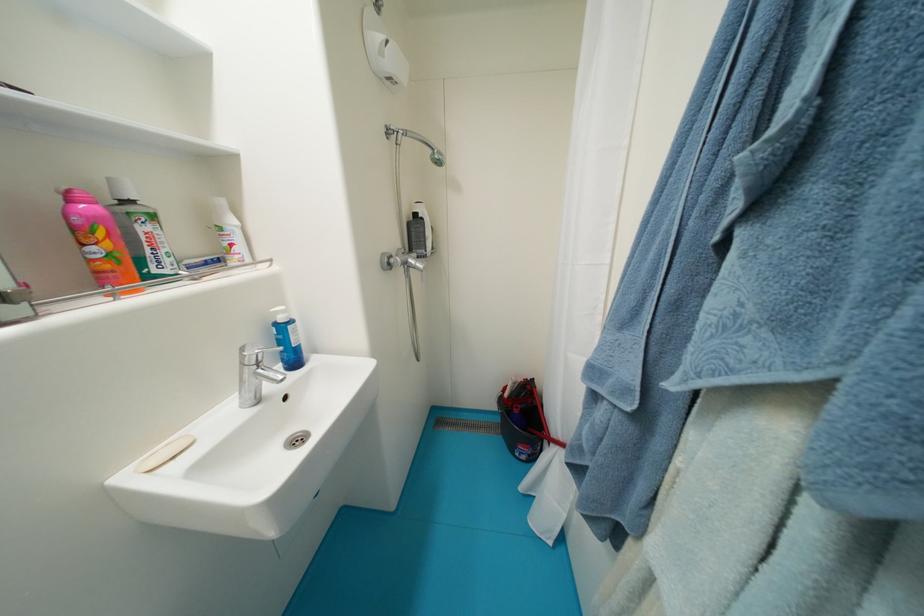
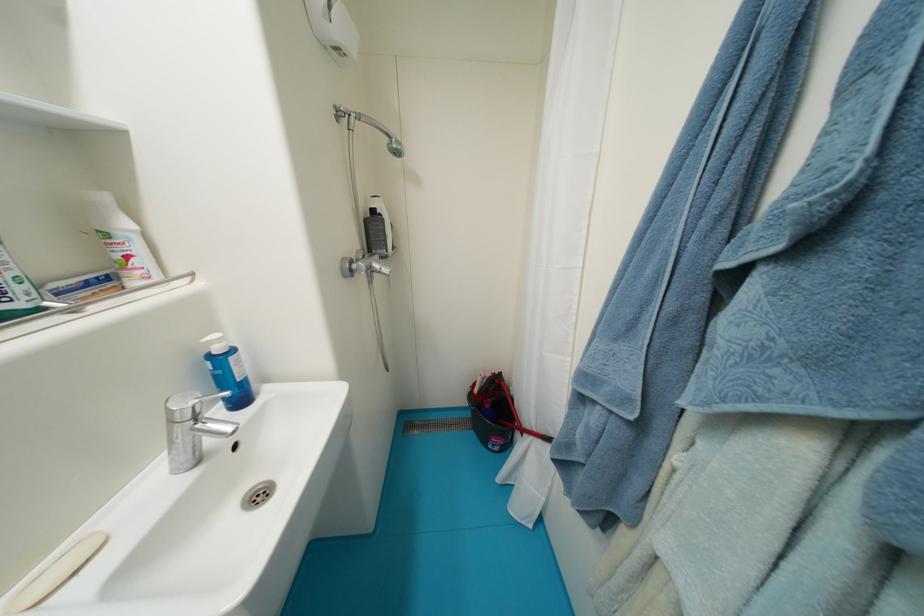
The point at (264, 366) is marked in the first image. Where is the corresponding point in the second image?

(203, 419)